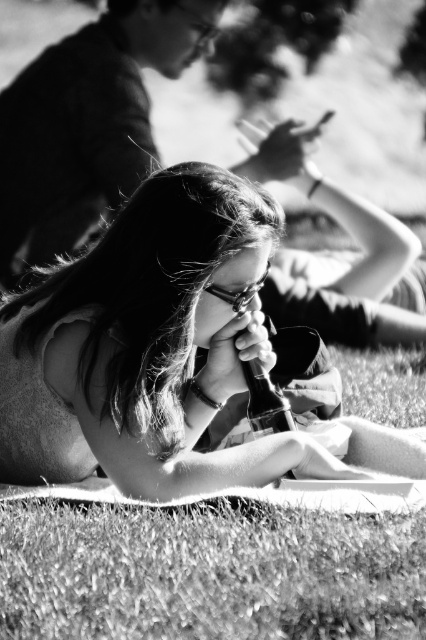
Can you confirm if smooth glass bottle at center is positioned below grassy at lower center?

No, smooth glass bottle at center is not below grassy at lower center.

What do you see at coordinates (164, 355) in the screenshot? The width and height of the screenshot is (426, 640). I see `smooth glass bottle at center` at bounding box center [164, 355].

Is point (181, 266) positioned in front of point (408, 612)?

No, (181, 266) is further to viewer.

Where is `smooth glass bottle at center`? This screenshot has width=426, height=640. smooth glass bottle at center is located at coordinates coord(164,355).